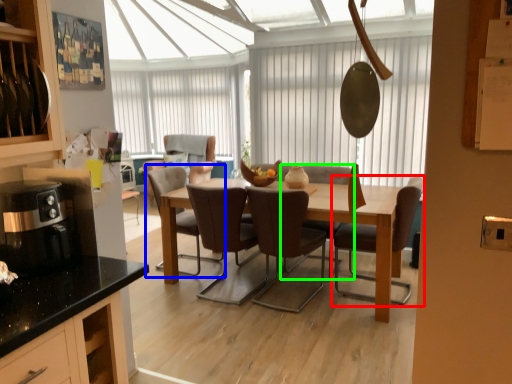
Question: Based on their relative distances, which object is farther from chair (highlighted by a red box)? Choose from chair (highlighted by a blue box) and chair (highlighted by a green box).

Choices:
 (A) chair
 (B) chair

Answer: (A)